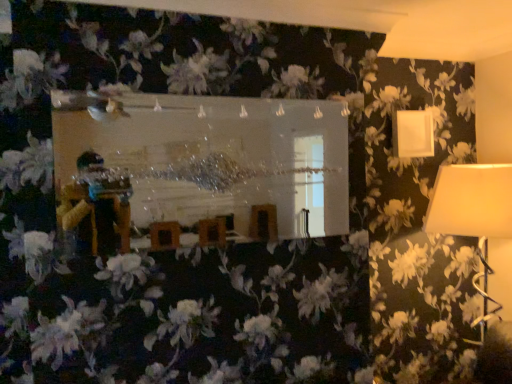
Question: Can you confirm if white fabric lampshade at right, positioned as the first lamp in bottom-to-top order, is positioned to the right of clear glass mirror at center?

Choices:
 (A) yes
 (B) no

Answer: (A)

Question: Can you confirm if white fabric lampshade at right, positioned as the first lamp in bottom-to-top order, is smaller than clear glass mirror at center?

Choices:
 (A) no
 (B) yes

Answer: (A)

Question: Can you confirm if white fabric lampshade at right, positioned as the first lamp in bottom-to-top order, is positioned to the left of clear glass mirror at center?

Choices:
 (A) no
 (B) yes

Answer: (A)

Question: Are white fabric lampshade at right, positioned as the first lamp in bottom-to-top order, and clear glass mirror at center located far from each other?

Choices:
 (A) no
 (B) yes

Answer: (B)

Question: Is the depth of white fabric lampshade at right, positioned as the first lamp in bottom-to-top order, greater than that of clear glass mirror at center?

Choices:
 (A) yes
 (B) no

Answer: (A)

Question: Does white fabric lampshade at right, the second lamp in the top-to-bottom sequence, have a larger size compared to clear glass mirror at center?

Choices:
 (A) yes
 (B) no

Answer: (A)

Question: Is clear glass mirror at center completely or partially outside of white fabric lampshade at right, positioned as the first lamp in bottom-to-top order?

Choices:
 (A) no
 (B) yes

Answer: (B)

Question: Is clear glass mirror at center touching white fabric lampshade at right, the second lamp in the top-to-bottom sequence?

Choices:
 (A) no
 (B) yes

Answer: (A)

Question: Is clear glass mirror at center further to camera compared to white fabric lampshade at right, positioned as the first lamp in bottom-to-top order?

Choices:
 (A) yes
 (B) no

Answer: (B)

Question: Considering the relative positions of clear glass mirror at center and white fabric lampshade at right, the second lamp in the top-to-bottom sequence, in the image provided, is clear glass mirror at center to the left of white fabric lampshade at right, the second lamp in the top-to-bottom sequence, from the viewer's perspective?

Choices:
 (A) yes
 (B) no

Answer: (A)

Question: Does clear glass mirror at center have a lesser height compared to white fabric lampshade at right, positioned as the first lamp in bottom-to-top order?

Choices:
 (A) yes
 (B) no

Answer: (A)

Question: Considering the relative sizes of clear glass mirror at center and white fabric lampshade at right, positioned as the first lamp in bottom-to-top order, in the image provided, is clear glass mirror at center wider than white fabric lampshade at right, positioned as the first lamp in bottom-to-top order,?

Choices:
 (A) no
 (B) yes

Answer: (A)

Question: Is white matte lampshade at upper right, which is counted as the 1th lamp, starting from the top, oriented away from white fabric lampshade at right, the second lamp in the top-to-bottom sequence?

Choices:
 (A) no
 (B) yes

Answer: (A)